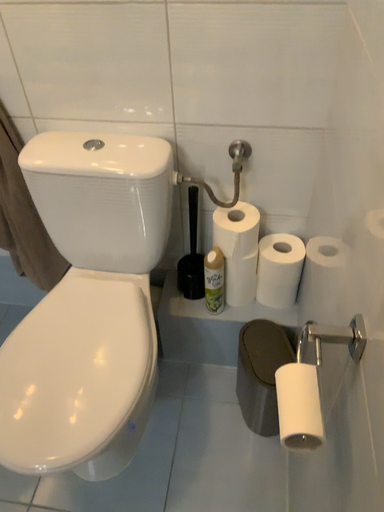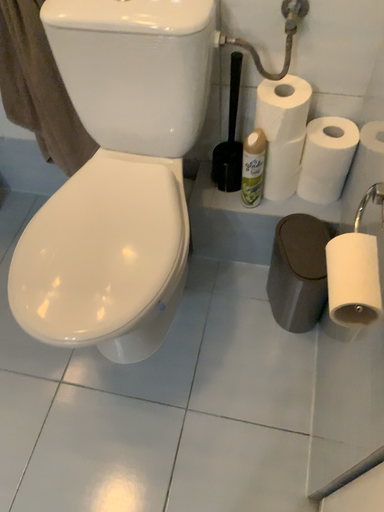
Question: How did the camera likely rotate when shooting the video?

Choices:
 (A) rotated downward
 (B) rotated upward

Answer: (A)